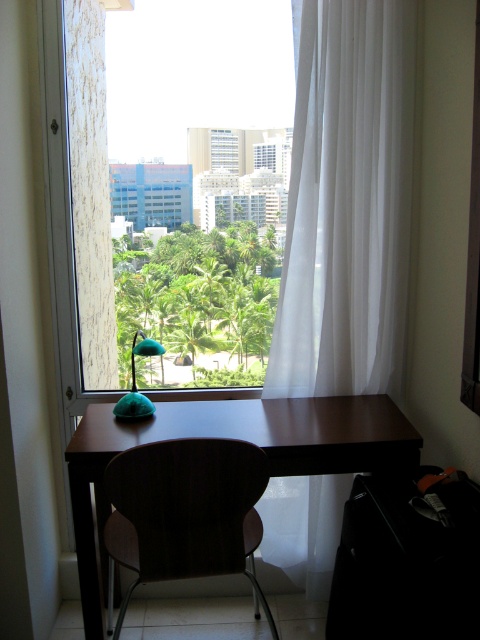
Is wooden chair at center taller than teal fabric lamp at lower left?

Yes, wooden chair at center is taller than teal fabric lamp at lower left.

Which is in front, point (144, 540) or point (139, 349)?

Point (144, 540)

What are the coordinates of `wooden chair at center` in the screenshot? It's located at (186, 512).

Is point (192, 97) closer to camera compared to point (107, 413)?

No, (192, 97) is further to viewer.

Who is more distant from viewer, (259, 227) or (278, 412)?

The point (259, 227) is more distant.

Where is `transparent glass window at center`? transparent glass window at center is located at coordinates (169, 237).

Does white sheer curtain at right appear on the right side of dark wood table at center?

Yes, white sheer curtain at right is to the right of dark wood table at center.

Is white sheer curtain at right further to the viewer compared to dark wood table at center?

Yes, it is behind dark wood table at center.

Between point (343, 99) and point (121, 444), which one is positioned behind?

The point (343, 99) is behind.

This screenshot has width=480, height=640. I want to click on white sheer curtain at right, so click(x=347, y=204).